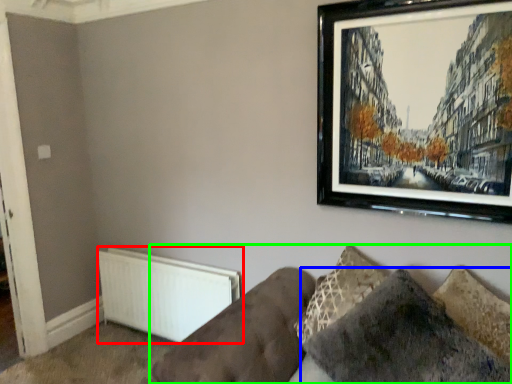
Question: Which object is positioned farthest from radiator (highlighted by a red box)? Select from pillow (highlighted by a blue box) and studio couch (highlighted by a green box).

Choices:
 (A) pillow
 (B) studio couch

Answer: (A)